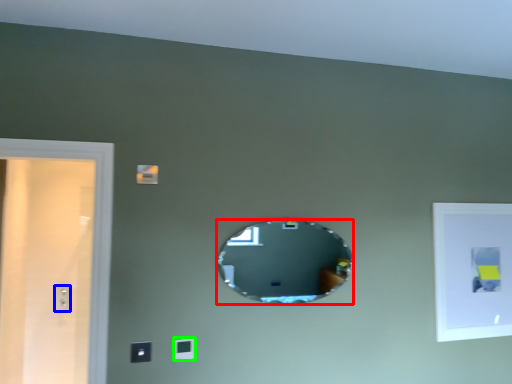
Question: Which object is the closest to the mirror (highlighted by a red box)? Choose among these: electric outlet (highlighted by a blue box) or light switch (highlighted by a green box).

Choices:
 (A) electric outlet
 (B) light switch

Answer: (B)